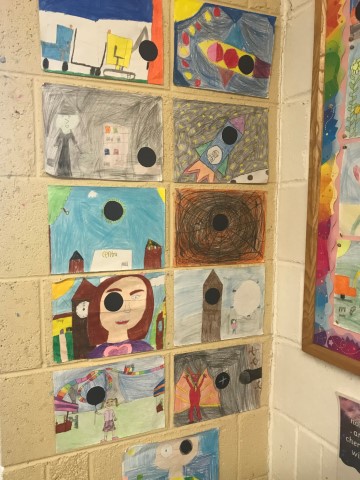
At what (x,y) coordinates should I click in order to perform the action: click on wall. Please return your answer as a coordinate pair (x, y). This screenshot has width=360, height=480. Looking at the image, I should click on (27, 399), (312, 372).